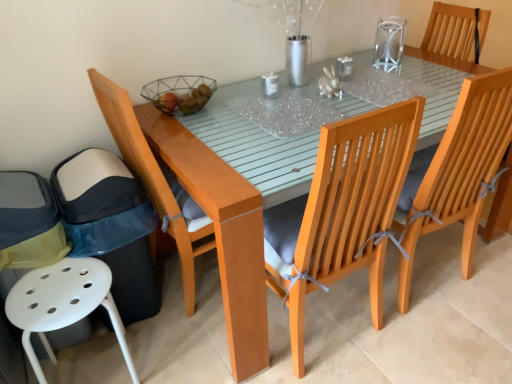
Image resolution: width=512 pixels, height=384 pixels. In order to click on vacant area located to the right-hand side of wire mesh basket at center in this screenshot , I will do `click(232, 106)`.